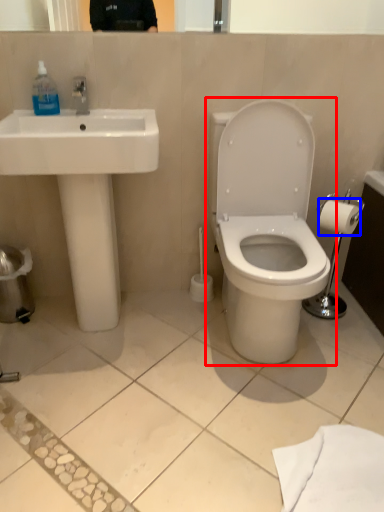
Question: Which point is closer to the camera, toilet (highlighted by a red box) or toilet paper (highlighted by a blue box)?

Choices:
 (A) toilet
 (B) toilet paper

Answer: (A)